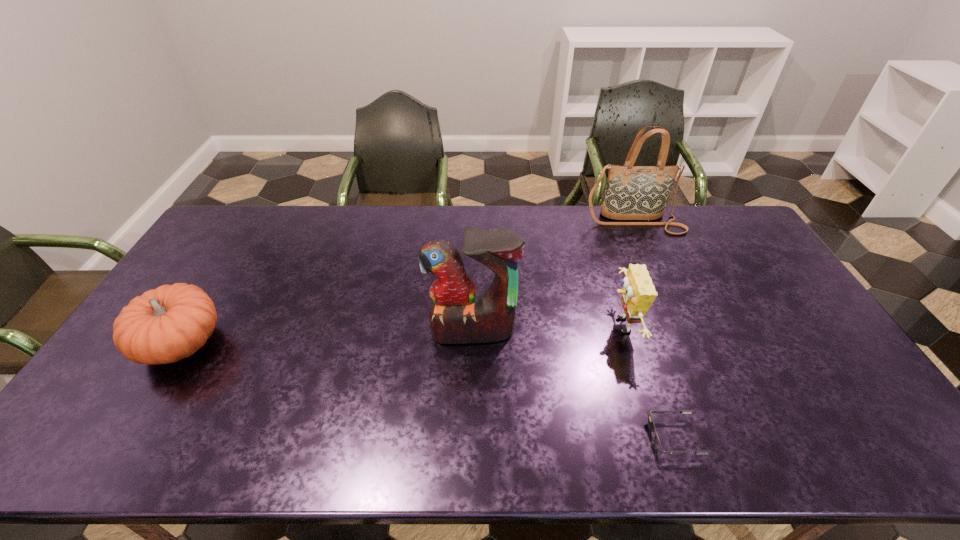
Locate an element on the screen. The height and width of the screenshot is (540, 960). vacant space situated 0.330m on the face of the sponge is located at coordinates 494,326.

In order to click on free space located 0.360m on the face of the sponge in this screenshot , I will do (484, 326).

Where is `vacant region located on the right of the leftmost object`? vacant region located on the right of the leftmost object is located at coordinates (252, 343).

This screenshot has height=540, width=960. I want to click on free space located 0.140m on the temples of the nearest object, so click(590, 437).

This screenshot has height=540, width=960. I want to click on free space located 0.320m on the temples of the nearest object, so click(515, 437).

Find the location of `vacant space located on the temples of the nearest object`. vacant space located on the temples of the nearest object is located at coordinates (587, 437).

Locate an element on the screen. This screenshot has height=540, width=960. object situated at the far edge is located at coordinates (632, 192).

You are a GUI agent. You are given a task and a screenshot of the screen. Output one action in this format:
    pyautogui.click(x=<x>, y=<y>)
    Task: Click on the object located in the near edge section of the desktop
    
    Given the screenshot: What is the action you would take?
    pyautogui.click(x=657, y=443)

The height and width of the screenshot is (540, 960). What are the coordinates of `object located in the left edge section of the desktop` in the screenshot? It's located at (164, 325).

Locate an element on the screen. This screenshot has height=540, width=960. free space at the far edge is located at coordinates (548, 208).